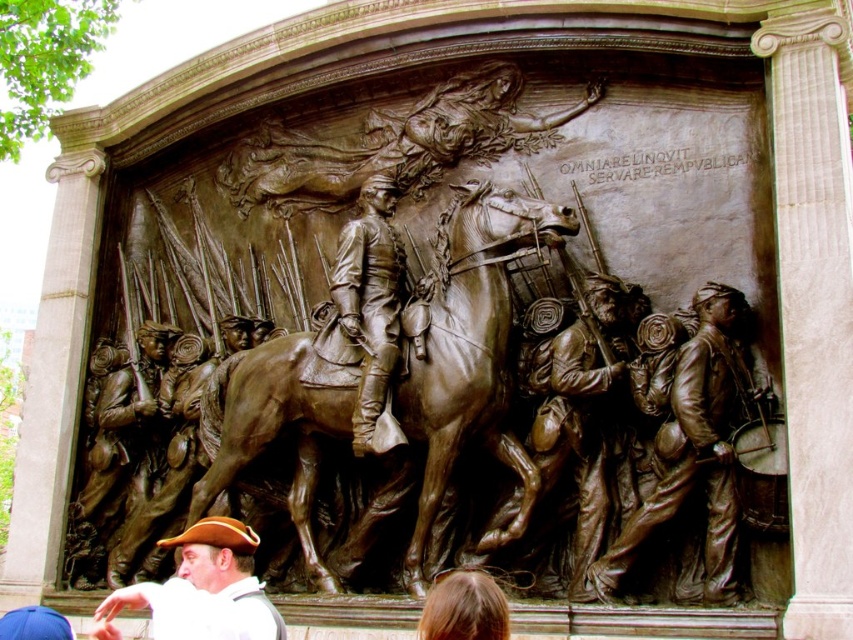
Does bronze at center appear on the right side of bronze figure at center?

Incorrect, bronze at center is not on the right side of bronze figure at center.

At what (x,y) coordinates should I click in order to perform the action: click on bronze at center. Please return your answer as a coordinate pair (x, y). The height and width of the screenshot is (640, 853). Looking at the image, I should click on (469, 349).

Locate an element on the screen. bronze at center is located at coordinates (469, 349).

Where is `bronze at center`? The width and height of the screenshot is (853, 640). bronze at center is located at coordinates (469, 349).

Locate an element on the screen. This screenshot has height=640, width=853. bronze at center is located at coordinates point(469,349).

Is bronze at center below blonde hair at lower center?

Actually, bronze at center is above blonde hair at lower center.

Where is `bronze at center`? The width and height of the screenshot is (853, 640). bronze at center is located at coordinates (469, 349).

Is point (752, 376) positioned after point (558, 416)?

No, (752, 376) is in front of (558, 416).

Looking at this image, who is positioned more to the right, bronze drum at right or bronze figure at center?

Positioned to the right is bronze drum at right.

Does point (734, 451) lie in front of point (602, 429)?

Yes.

Locate an element on the screen. bronze drum at right is located at coordinates (699, 445).